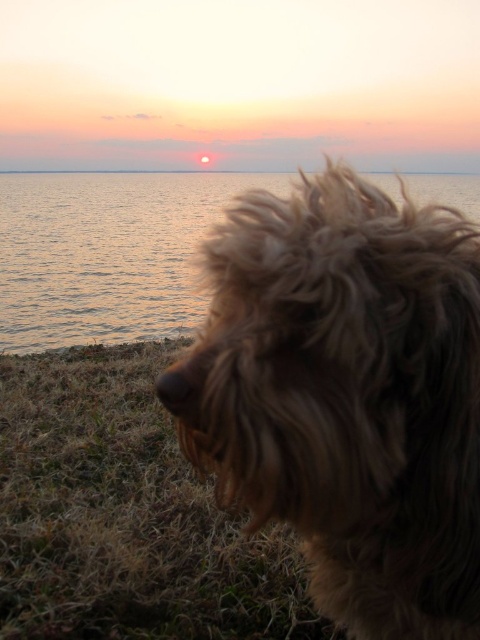
Is shiny blue water at center to the right of smooth ocean at center from the viewer's perspective?

Yes, shiny blue water at center is to the right of smooth ocean at center.

Is shiny blue water at center positioned before smooth ocean at center?

Yes.

This screenshot has width=480, height=640. Find the location of `shiny blue water at center`. shiny blue water at center is located at coordinates (107, 253).

The image size is (480, 640). I want to click on shiny blue water at center, so click(107, 253).

Can you confirm if fuzzy brown dog at center is positioned to the left of smooth ocean at center?

Incorrect, fuzzy brown dog at center is not on the left side of smooth ocean at center.

Can you confirm if fuzzy brown dog at center is positioned to the right of smooth ocean at center?

Indeed, fuzzy brown dog at center is positioned on the right side of smooth ocean at center.

The width and height of the screenshot is (480, 640). What do you see at coordinates (347, 396) in the screenshot?
I see `fuzzy brown dog at center` at bounding box center [347, 396].

You are a GUI agent. You are given a task and a screenshot of the screen. Output one action in this format:
    pyautogui.click(x=<x>, y=<y>)
    Task: Click on the fuzzy brown dog at center
    The image size is (480, 640).
    Given the screenshot: What is the action you would take?
    pyautogui.click(x=347, y=396)

Does brown grassy at lower left appear over shiny blue water at center?

No.

Who is lower down, brown grassy at lower left or shiny blue water at center?

brown grassy at lower left is below.

Find the location of a particular element. brown grassy at lower left is located at coordinates (126, 515).

At what (x,y) coordinates should I click in order to perform the action: click on brown grassy at lower left. Please return your answer as a coordinate pair (x, y). Image resolution: width=480 pixels, height=640 pixels. Looking at the image, I should click on (126, 515).